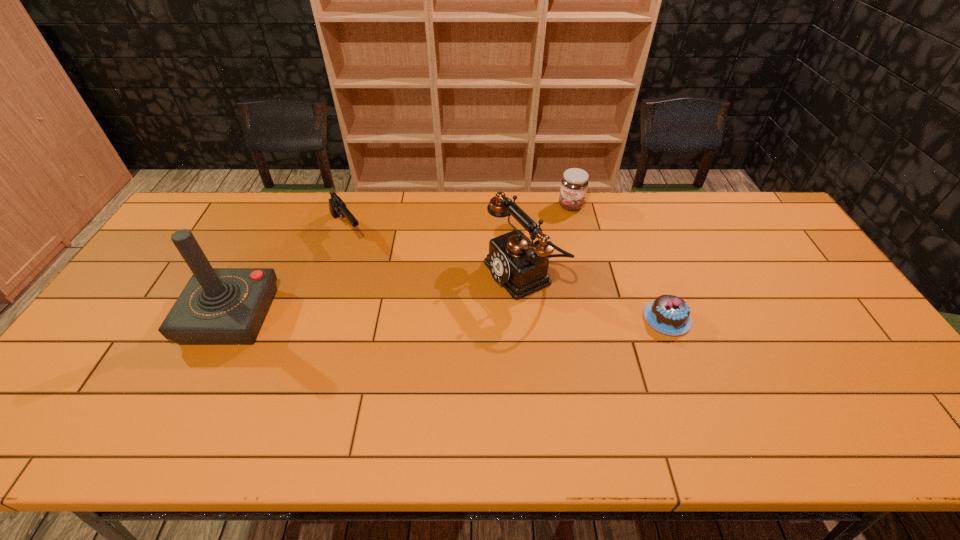
You are a GUI agent. You are given a task and a screenshot of the screen. Output one action in this format:
    pyautogui.click(x=<x>, y=<y>)
    Task: Click on the vacant point located between the gun and the third object from left to right
    The width and height of the screenshot is (960, 540).
    Given the screenshot: What is the action you would take?
    pyautogui.click(x=436, y=251)

Identify the location of free area in between the gun and the second object from right to left. This screenshot has width=960, height=540. (459, 218).

At what (x,y) coordinates should I click in order to perform the action: click on free spot between the chocolate cake and the third object from right to left. Please return your answer as a coordinate pair (x, y). This screenshot has width=960, height=540. Looking at the image, I should click on pyautogui.click(x=595, y=296).

Where is `free space between the second tallest object and the gun`? This screenshot has height=540, width=960. free space between the second tallest object and the gun is located at coordinates (436, 251).

You are a GUI agent. You are given a task and a screenshot of the screen. Output one action in this format:
    pyautogui.click(x=<x>, y=<y>)
    Task: Click on the vacant area that lies between the tallest object and the second tallest object
    
    Given the screenshot: What is the action you would take?
    pyautogui.click(x=377, y=295)

Locate an element on the screen. This screenshot has width=960, height=540. object that ranks as the second closest to the shortest object is located at coordinates (574, 183).

This screenshot has height=540, width=960. In order to click on the fourth closest object to the telephone in this screenshot , I will do `click(219, 306)`.

What are the coordinates of `vacant area in the image that satisfies the following two spatial constraints: 1. on the back side of the jam; 2. on the left side of the gun` in the screenshot? It's located at 354,206.

You are a GUI agent. You are given a task and a screenshot of the screen. Output one action in this format:
    pyautogui.click(x=<x>, y=<y>)
    Task: Click on the free space that satisfies the following two spatial constraints: 1. on the back side of the fourth object from left to right; 2. on the left side of the third object from left to right
    This screenshot has height=540, width=960.
    Given the screenshot: What is the action you would take?
    pyautogui.click(x=517, y=206)